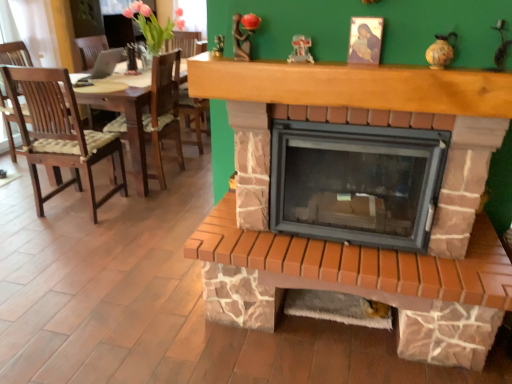
Question: From the image's perspective, is brick fireplace at center located above or below brown wood mantle at upper center?

Choices:
 (A) below
 (B) above

Answer: (A)

Question: Does point (275, 162) appear closer or farther from the camera than point (345, 86)?

Choices:
 (A) farther
 (B) closer

Answer: (A)

Question: From a real-world perspective, is brick fireplace at center positioned above or below brown wood mantle at upper center?

Choices:
 (A) below
 (B) above

Answer: (A)

Question: Is brown wood mantle at upper center to the left or to the right of brick fireplace at center in the image?

Choices:
 (A) right
 (B) left

Answer: (B)

Question: Is brown wood mantle at upper center spatially inside brick fireplace at center, or outside of it?

Choices:
 (A) inside
 (B) outside

Answer: (B)

Question: From the image's perspective, is brown wood mantle at upper center positioned above or below brick fireplace at center?

Choices:
 (A) above
 (B) below

Answer: (A)

Question: Considering the positions of brown wood mantle at upper center and brick fireplace at center in the image, is brown wood mantle at upper center bigger or smaller than brick fireplace at center?

Choices:
 (A) small
 (B) big

Answer: (A)